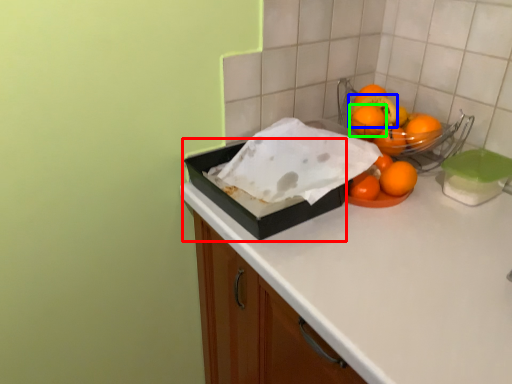
Question: Based on their relative distances, which object is nearer to box (highlighted by a red box)? Choose from fruit (highlighted by a blue box) and orange (highlighted by a green box).

Choices:
 (A) fruit
 (B) orange

Answer: (B)